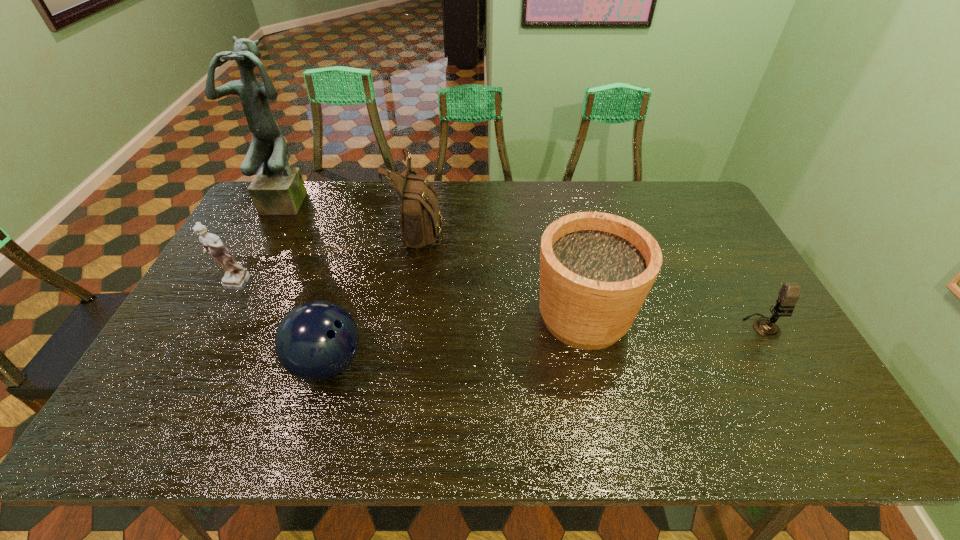
Locate an element on the screen. This screenshot has width=960, height=540. free space located 0.250m on the front-facing side of the figurine is located at coordinates (184, 373).

Locate an element on the screen. The height and width of the screenshot is (540, 960). free space located 0.070m on the surface of the fourth object from right to left near the finger holes is located at coordinates (394, 363).

Identify the location of vacant area situated on the front-facing side of the microphone. This screenshot has height=540, width=960. (779, 355).

This screenshot has height=540, width=960. I want to click on sculpture that is at the far edge, so click(x=277, y=189).

Image resolution: width=960 pixels, height=540 pixels. Find the location of `shoulder bag at the far edge`. shoulder bag at the far edge is located at coordinates (421, 220).

You are a GUI agent. You are given a task and a screenshot of the screen. Output one action in this format:
    pyautogui.click(x=<x>, y=<y>)
    Task: Click on the sculpture that is at the left edge
    
    Given the screenshot: What is the action you would take?
    [x=277, y=189]

Locate an element on the screen. figurine that is positioned at the left edge is located at coordinates (236, 277).

You are a GUI agent. You are given a task and a screenshot of the screen. Output one action in this format:
    pyautogui.click(x=<x>, y=<y>)
    Task: Click on the object positioned at the right edge
    The height and width of the screenshot is (540, 960).
    Given the screenshot: What is the action you would take?
    pyautogui.click(x=789, y=293)

In order to click on object that is at the far left corner in this screenshot , I will do `click(277, 189)`.

In the image, there is a desktop. At what (x,y) coordinates should I click in order to perform the action: click on vacant space at the far edge. Please return your answer as a coordinate pair (x, y). The image size is (960, 540). Looking at the image, I should click on (653, 203).